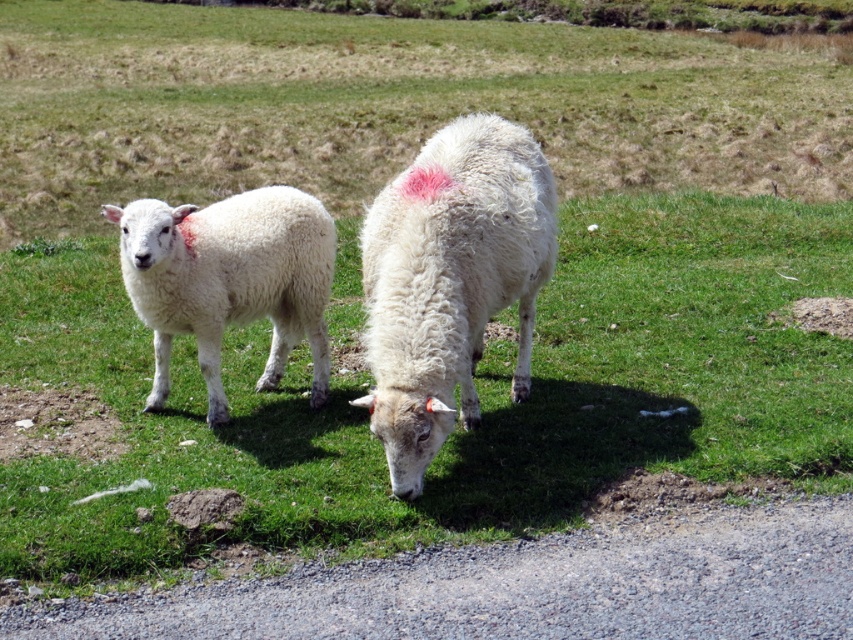
Question: Is white woolen sheep at center wider than white woolen lamb at left?

Choices:
 (A) no
 (B) yes

Answer: (A)

Question: Is white woolen sheep at center to the right of white woolen lamb at left from the viewer's perspective?

Choices:
 (A) yes
 (B) no

Answer: (A)

Question: Among these objects, which one is farthest from the camera?

Choices:
 (A) white woolen lamb at left
 (B) white woolen sheep at center

Answer: (A)

Question: Is white woolen sheep at center below white woolen lamb at left?

Choices:
 (A) yes
 (B) no

Answer: (A)

Question: Which point is closer to the camera?

Choices:
 (A) white woolen lamb at left
 (B) white woolen sheep at center

Answer: (B)